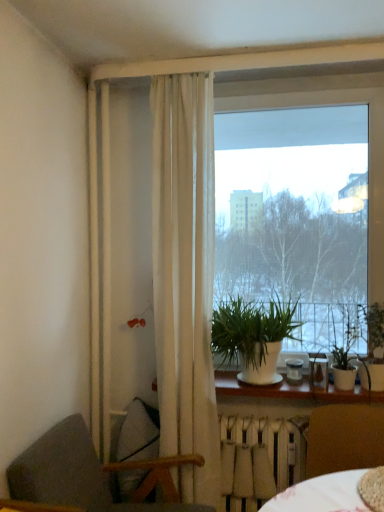
Question: Considering the relative sizes of white sheer curtain at center and green matte plant at right, the 1th houseplant in the right-to-left sequence, in the image provided, is white sheer curtain at center smaller than green matte plant at right, the 1th houseplant in the right-to-left sequence,?

Choices:
 (A) no
 (B) yes

Answer: (A)

Question: Is white sheer curtain at center in front of green matte plant at right, the 1th houseplant in the right-to-left sequence?

Choices:
 (A) no
 (B) yes

Answer: (B)

Question: Does white sheer curtain at center have a lesser height compared to green matte plant at right, the third houseplant from the left?

Choices:
 (A) no
 (B) yes

Answer: (A)

Question: Can you confirm if white sheer curtain at center is wider than green matte plant at right, the third houseplant from the left?

Choices:
 (A) yes
 (B) no

Answer: (B)

Question: Is white sheer curtain at center bigger than green matte plant at right, the 1th houseplant in the right-to-left sequence?

Choices:
 (A) yes
 (B) no

Answer: (A)

Question: Is green matte plant at right, the third houseplant from the left, located within white sheer curtain at center?

Choices:
 (A) yes
 (B) no

Answer: (B)

Question: Is white matte radiator at lower center wider than white sheer curtain at center?

Choices:
 (A) yes
 (B) no

Answer: (B)

Question: Considering the relative sizes of white matte radiator at lower center and white sheer curtain at center in the image provided, is white matte radiator at lower center bigger than white sheer curtain at center?

Choices:
 (A) no
 (B) yes

Answer: (A)

Question: Can you confirm if white matte radiator at lower center is positioned to the right of white sheer curtain at center?

Choices:
 (A) no
 (B) yes

Answer: (B)

Question: Considering the relative positions of white matte radiator at lower center and white sheer curtain at center in the image provided, is white matte radiator at lower center behind white sheer curtain at center?

Choices:
 (A) no
 (B) yes

Answer: (B)

Question: Is white matte radiator at lower center surrounding white sheer curtain at center?

Choices:
 (A) yes
 (B) no

Answer: (B)

Question: From the image's perspective, is white matte radiator at lower center below white sheer curtain at center?

Choices:
 (A) no
 (B) yes

Answer: (B)

Question: Is white matte plant at center, the 1th houseplant from the left, aimed at dark gray fabric chair at lower left, the second chair from the right?

Choices:
 (A) no
 (B) yes

Answer: (A)